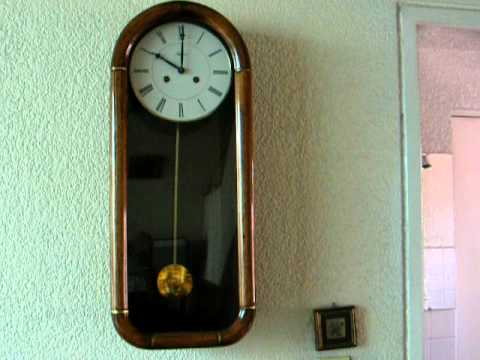
This screenshot has width=480, height=360. Identify the location of clock. (222, 228).